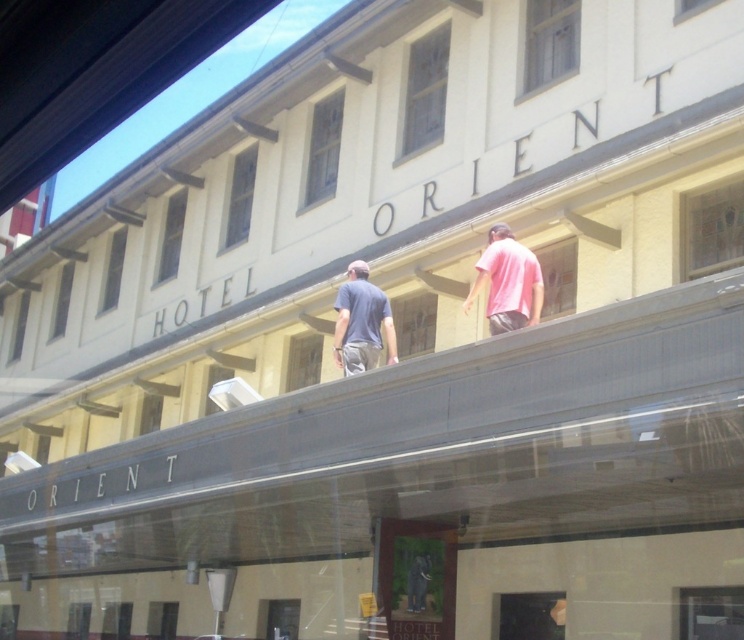
Is pink matte shirt at upper right behind dark blue t-shirt at center?

No, pink matte shirt at upper right is in front of dark blue t-shirt at center.

Is pink matte shirt at upper right to the right of dark blue t-shirt at center from the viewer's perspective?

Correct, you'll find pink matte shirt at upper right to the right of dark blue t-shirt at center.

Does point (493, 282) come in front of point (339, 308)?

Yes, it is.

At what (x,y) coordinates should I click in order to perform the action: click on pink matte shirt at upper right. Please return your answer as a coordinate pair (x, y). The image size is (744, 640). Looking at the image, I should click on tap(507, 282).